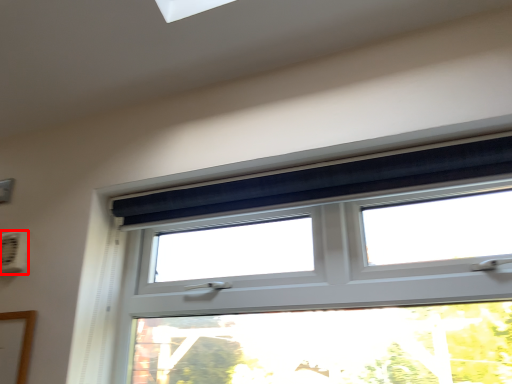
Question: From the image's perspective, what is the correct spatial positioning of air conditioning (annotated by the red box) in reference to window?

Choices:
 (A) above
 (B) below

Answer: (A)